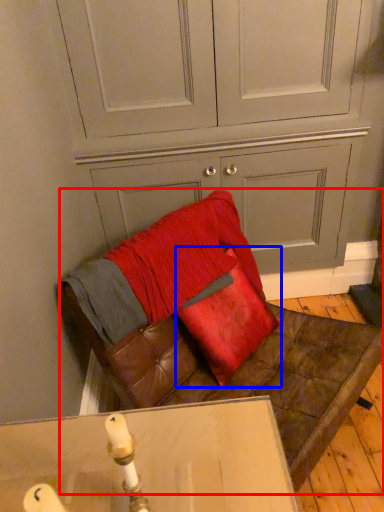
Question: Which point is closer to the camera, furniture (highlighted by a red box) or throw pillow (highlighted by a blue box)?

Choices:
 (A) furniture
 (B) throw pillow

Answer: (A)